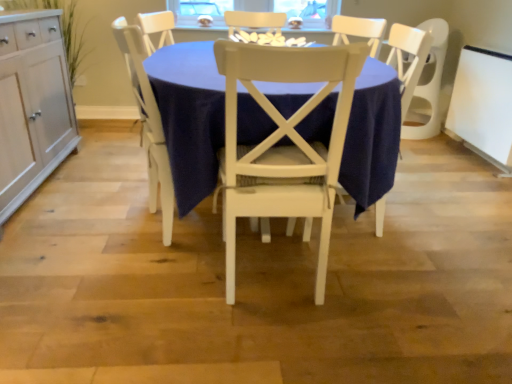
Question: Would you say white glossy cookies at center is to the left or to the right of white wood cabinet at left in the picture?

Choices:
 (A) left
 (B) right

Answer: (B)

Question: Choose the correct answer: Is white glossy cookies at center inside white wood cabinet at left or outside it?

Choices:
 (A) inside
 (B) outside

Answer: (B)

Question: Considering the real-world distances, which object is farthest from the white glossy cookies at center?

Choices:
 (A) white painted wood chair at center, arranged as the 1th chair when viewed from the right
 (B) white wood chair at center
 (C) white wood cabinet at left
 (D) white wood chair at center, the first chair in the left-to-right sequence

Answer: (C)

Question: Which of these objects is positioned closest to the white wood chair at center, which ranks as the second chair in right-to-left order?

Choices:
 (A) white painted wood chair at center, arranged as the 1th chair when viewed from the right
 (B) white wood cabinet at left
 (C) white glossy cookies at center
 (D) white wood chair at center

Answer: (A)